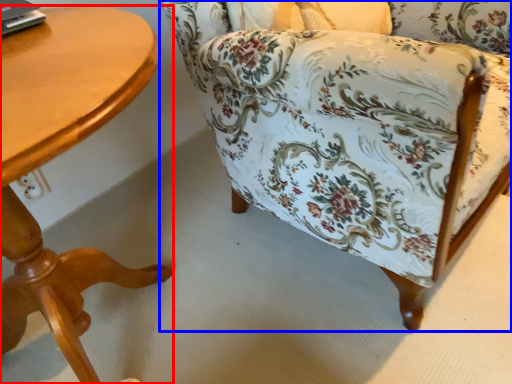
Question: Among these objects, which one is farthest to the camera, table (highlighted by a red box) or chair (highlighted by a blue box)?

Choices:
 (A) table
 (B) chair

Answer: (B)